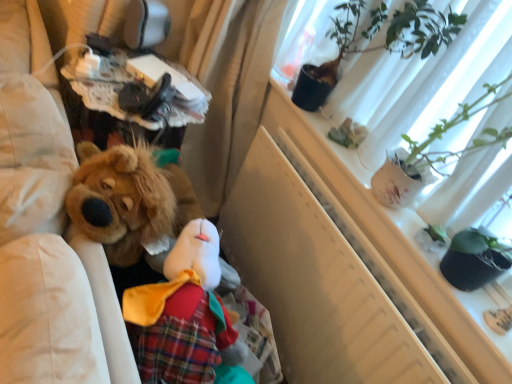
Question: Which is correct: green leafy plant at upper right is inside white matte window screen at upper right, or outside of it?

Choices:
 (A) outside
 (B) inside

Answer: (A)

Question: From the image's perspective, relative to white matte window screen at upper right, is green leafy plant at upper right above or below?

Choices:
 (A) above
 (B) below

Answer: (A)

Question: Considering their positions, is green leafy plant at upper right located in front of or behind white matte window screen at upper right?

Choices:
 (A) behind
 (B) front

Answer: (A)

Question: In terms of width, does white matte window screen at upper right look wider or thinner when compared to green leafy plant at upper right?

Choices:
 (A) wide
 (B) thin

Answer: (A)

Question: Would you say white matte window screen at upper right is to the left or to the right of green leafy plant at upper right in the picture?

Choices:
 (A) left
 (B) right

Answer: (B)

Question: In the image, is white matte window screen at upper right positioned in front of or behind green leafy plant at upper right?

Choices:
 (A) behind
 (B) front

Answer: (B)

Question: Is white matte window screen at upper right bigger or smaller than green leafy plant at upper right?

Choices:
 (A) big
 (B) small

Answer: (B)